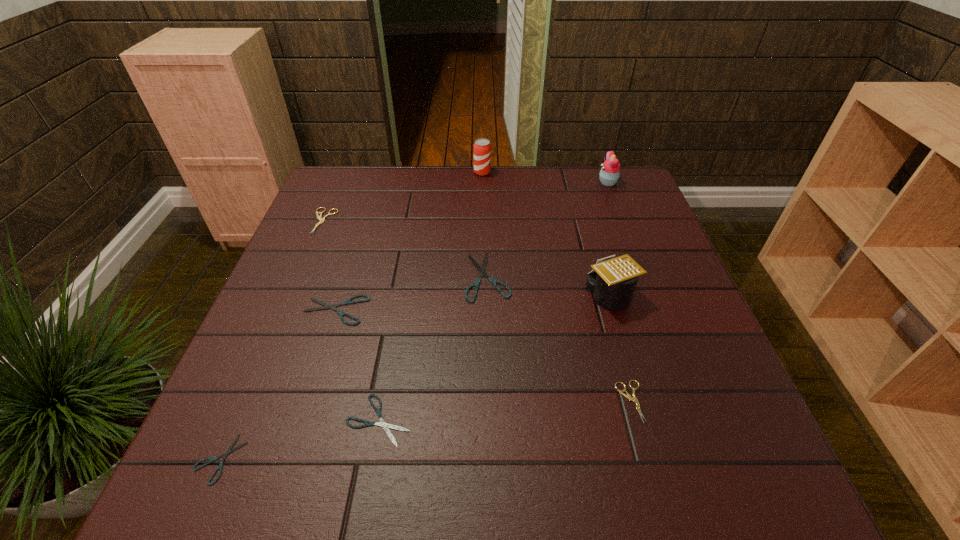
The height and width of the screenshot is (540, 960). In order to click on calculator at the right edge in this screenshot , I will do `click(612, 282)`.

Locate an element on the screen. The height and width of the screenshot is (540, 960). object located at the far left corner is located at coordinates (321, 220).

At what (x,y) coordinates should I click in order to perform the action: click on object that is positioned at the near left corner. Please return your answer as a coordinate pair (x, y). The height and width of the screenshot is (540, 960). Looking at the image, I should click on (229, 450).

Identify the location of object that is at the far right corner. This screenshot has height=540, width=960. (610, 172).

The image size is (960, 540). In the image, there is a desktop. What are the coordinates of `free space at the far edge` in the screenshot? It's located at [x=420, y=193].

Find the location of a particular element. The height and width of the screenshot is (540, 960). free space at the near edge of the desktop is located at coordinates (308, 457).

The image size is (960, 540). In the image, there is a desktop. Find the location of `vacant space at the left edge`. vacant space at the left edge is located at coordinates (315, 251).

You are a GUI agent. You are given a task and a screenshot of the screen. Output one action in this format:
    pyautogui.click(x=<x>, y=<y>)
    Task: Click on the vacant region at the right edge of the desktop
    The image size is (960, 540).
    Given the screenshot: What is the action you would take?
    pyautogui.click(x=650, y=210)

You are a GUI agent. You are given a task and a screenshot of the screen. Output one action in this format:
    pyautogui.click(x=<x>, y=<y>)
    Task: Click on the vacant space at the far left corner of the desktop
    The image size is (960, 540).
    Given the screenshot: What is the action you would take?
    pyautogui.click(x=336, y=187)

Where is `vacant space at the near left corner of the desktop`? vacant space at the near left corner of the desktop is located at coordinates (261, 461).